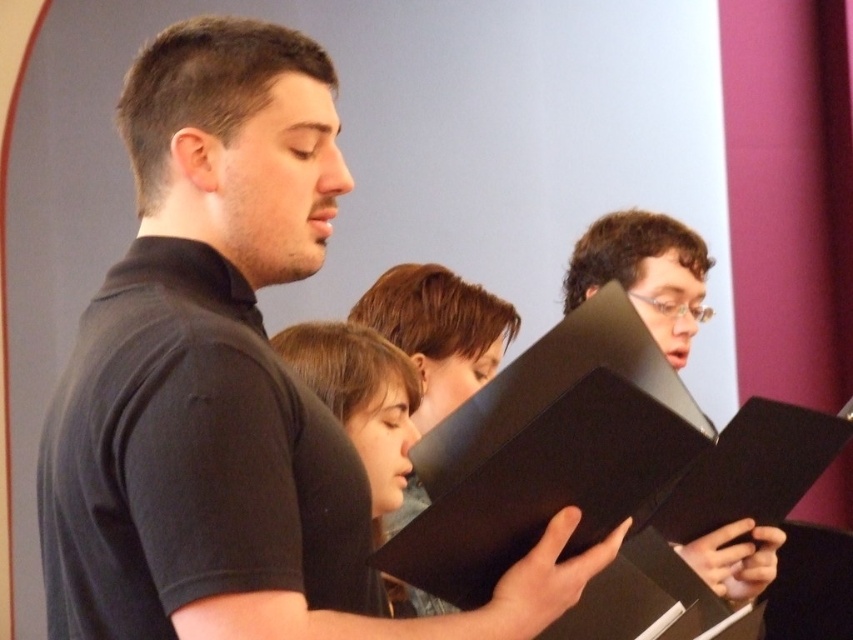
Question: Where is black matte book at center located in relation to matte black book at center in the image?

Choices:
 (A) above
 (B) below

Answer: (A)

Question: Which point is farther to the camera?

Choices:
 (A) (219, 298)
 (B) (341, 392)

Answer: (B)

Question: Is the position of black matte book at center more distant than that of matte black book at center?

Choices:
 (A) no
 (B) yes

Answer: (A)

Question: Is black matte book at center above matte black book at center?

Choices:
 (A) no
 (B) yes

Answer: (B)

Question: Which point appears farthest from the camera in this image?

Choices:
 (A) (123, 333)
 (B) (376, 518)

Answer: (B)

Question: Which object appears farthest from the camera in this image?

Choices:
 (A) black matte book at center
 (B) matte black book at center

Answer: (B)